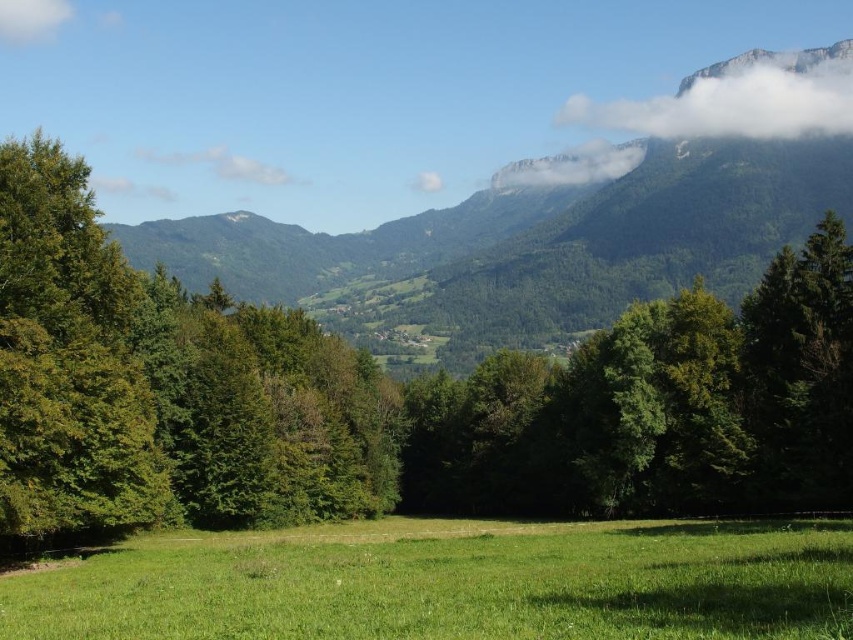
You are an airplane pilot flying at a high altitude and notice two clouds in the sky. You see the white fluffy cloud at upper center and the white fluffy cloud at upper left. Which cloud is higher in the sky?

The white fluffy cloud at upper center is higher in the sky because it is taller than the white fluffy cloud at upper left.

Based on the photo, you are standing in the meadow and want to take a photo of the green leafy tree at center and the white fluffy cloud at upper right. Which object appears closer to you in the photo?

The green leafy tree at center appears closer to you in the photo because it is smaller than the white fluffy cloud at upper right, indicating it is physically closer to the observer.